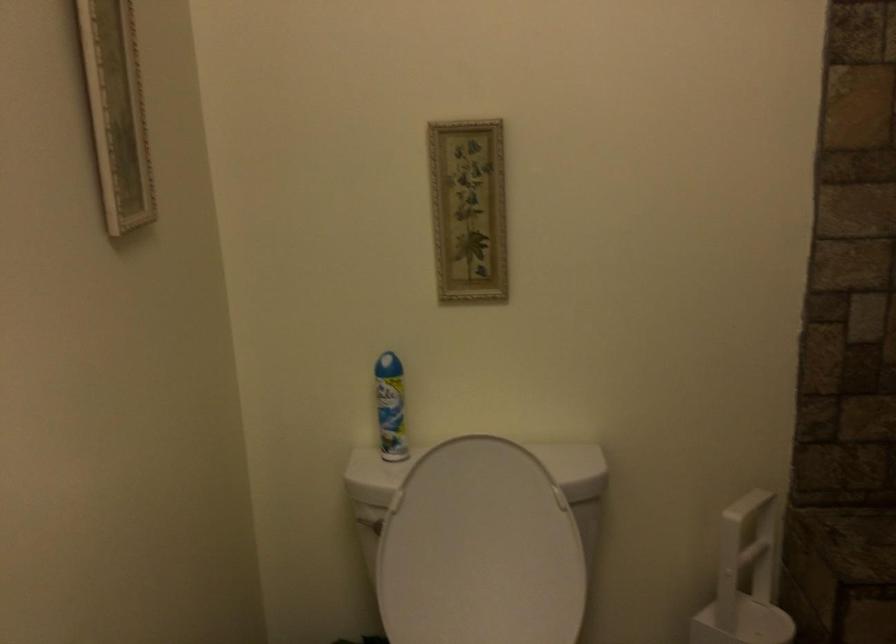
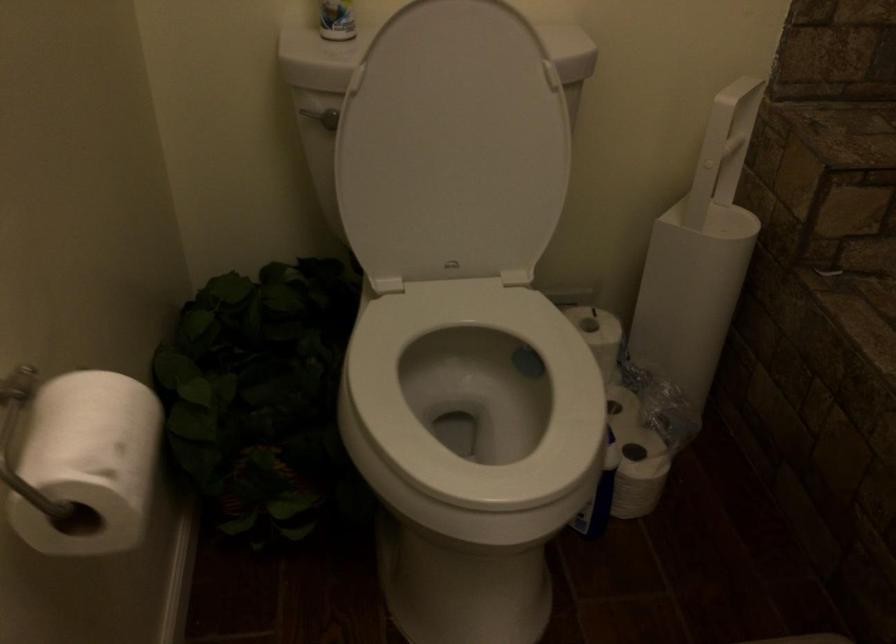
Which direction would the cameraman need to move to produce the second image?

The movement direction of the cameraman is left, forward.